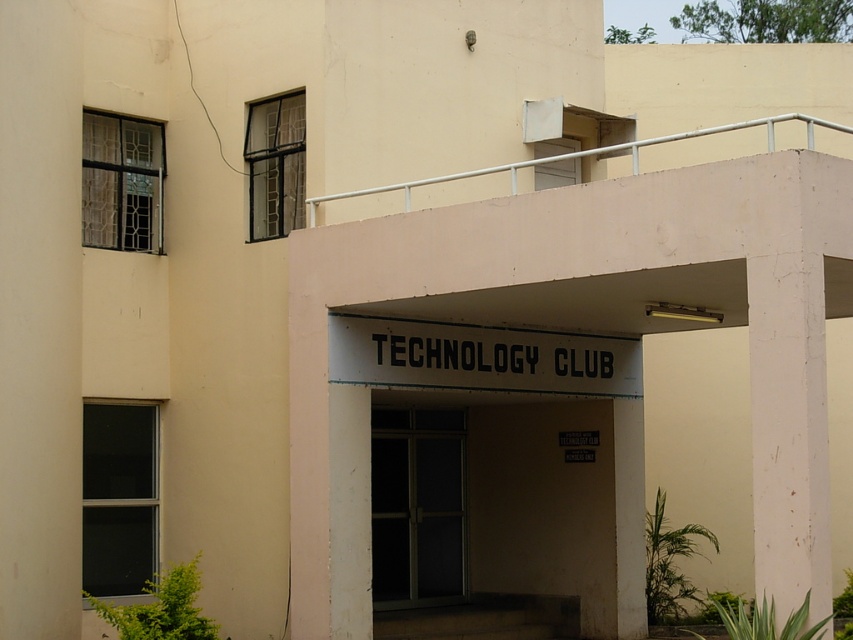
Consider the image. Can you confirm if white painted concrete pillar at right is shorter than transparent glass door at center?

In fact, white painted concrete pillar at right may be taller than transparent glass door at center.

Is white painted concrete pillar at right below transparent glass door at center?

No.

Does point (798, 324) come in front of point (398, 426)?

Yes, point (798, 324) is closer to viewer.

Image resolution: width=853 pixels, height=640 pixels. I want to click on white painted concrete pillar at right, so pyautogui.click(x=788, y=432).